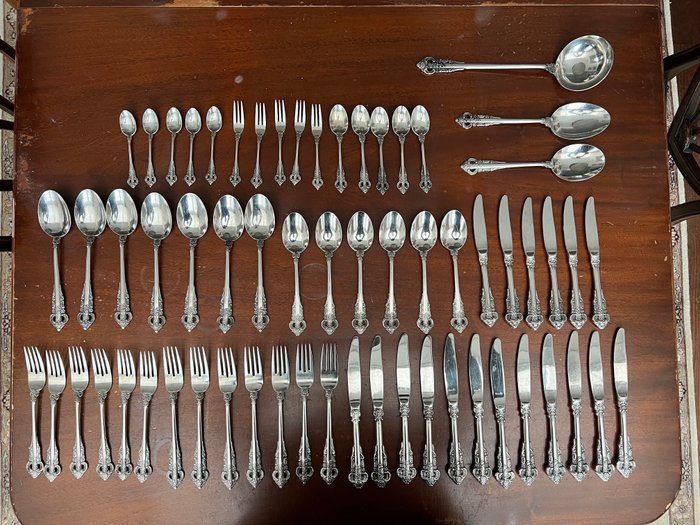
You are a GUI agent. You are given a task and a screenshot of the screen. Output one action in this format:
    pyautogui.click(x=<x>, y=<y>)
    Task: Click on the small spoons
    This screenshot has width=700, height=525.
    Given the screenshot: What is the action you would take?
    pyautogui.click(x=129, y=122), pyautogui.click(x=147, y=121), pyautogui.click(x=172, y=118), pyautogui.click(x=189, y=118), pyautogui.click(x=214, y=117), pyautogui.click(x=340, y=120), pyautogui.click(x=360, y=116), pyautogui.click(x=379, y=118), pyautogui.click(x=399, y=119), pyautogui.click(x=420, y=120)